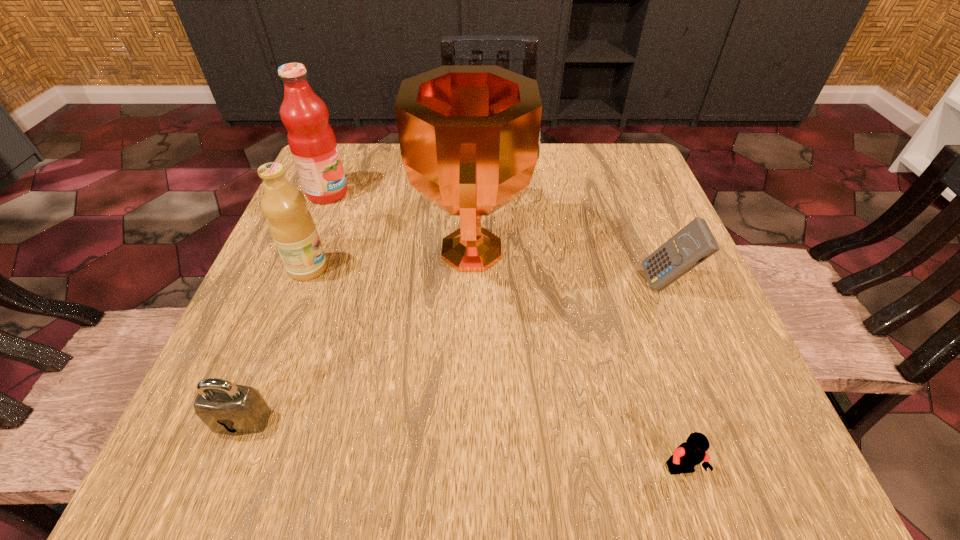
Where is `award`? award is located at coordinates (469, 135).

The width and height of the screenshot is (960, 540). Find the location of `fruit juice`. fruit juice is located at coordinates (311, 139).

You are a GUI agent. You are given a task and a screenshot of the screen. Output one action in this format:
    pyautogui.click(x=<x>, y=<y>)
    Task: Click on the olive oil
    Image resolution: width=960 pixels, height=540 pixels.
    Given the screenshot: What is the action you would take?
    pyautogui.click(x=291, y=225)

Where is `the rightmost object`? Image resolution: width=960 pixels, height=540 pixels. the rightmost object is located at coordinates (694, 243).

Locate an element on the screen. calculator is located at coordinates (694, 243).

The width and height of the screenshot is (960, 540). What are the coordinates of `the second nearest object` in the screenshot? It's located at (226, 408).

At what (x,y) coordinates should I click in order to perform the action: click on padlock. Please return your answer as a coordinate pair (x, y). Image resolution: width=960 pixels, height=540 pixels. Looking at the image, I should click on (226, 408).

Identify the location of Lego. (686, 456).

You are a GUI agent. You are given a task and a screenshot of the screen. Output one action in this format:
    pyautogui.click(x=<x>, y=<y>)
    Task: Click on the shortest object
    The height and width of the screenshot is (540, 960).
    Given the screenshot: What is the action you would take?
    pyautogui.click(x=686, y=456)

I want to click on vacant space located 0.260m on the side of the award with the star emblem, so [660, 251].